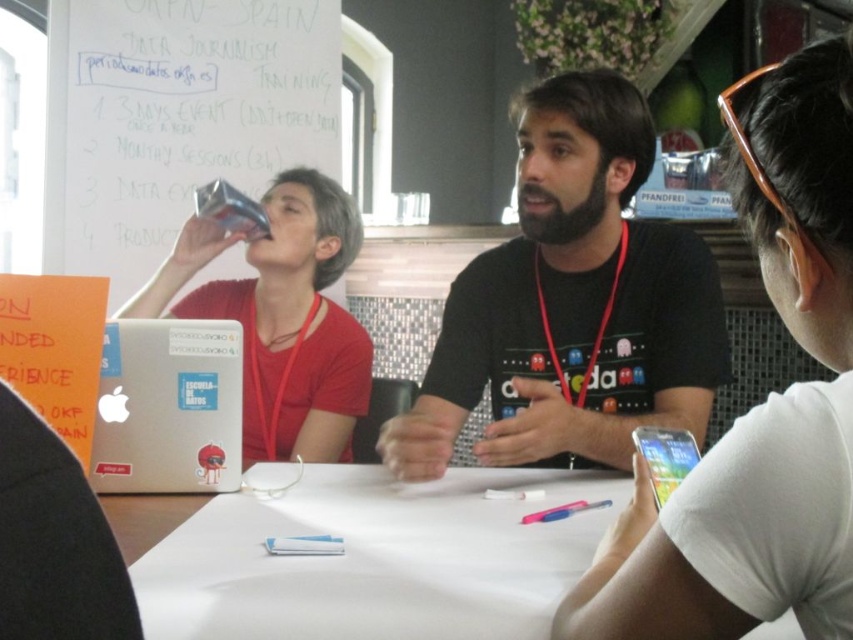
Who is more distant from viewer, (610, 600) or (340, 416)?

Point (340, 416)

Where is `black matte shirt at center`? This screenshot has width=853, height=640. black matte shirt at center is located at coordinates (759, 404).

Is black matte shirt at center shorter than white paper at center?

Incorrect, black matte shirt at center's height does not fall short of white paper at center's.

Which of these two, black matte shirt at center or white paper at center, stands shorter?

white paper at center

Who is more distant from viewer, (706, 604) or (128, 570)?

The point (128, 570) is more distant.

Find the location of `black matte shirt at center`. black matte shirt at center is located at coordinates pos(759,404).

Between matte black laptop at left and clear glass bottle at upper right, which one is positioned lower?

matte black laptop at left

Where is `matte black laptop at left`? The height and width of the screenshot is (640, 853). matte black laptop at left is located at coordinates (296, 324).